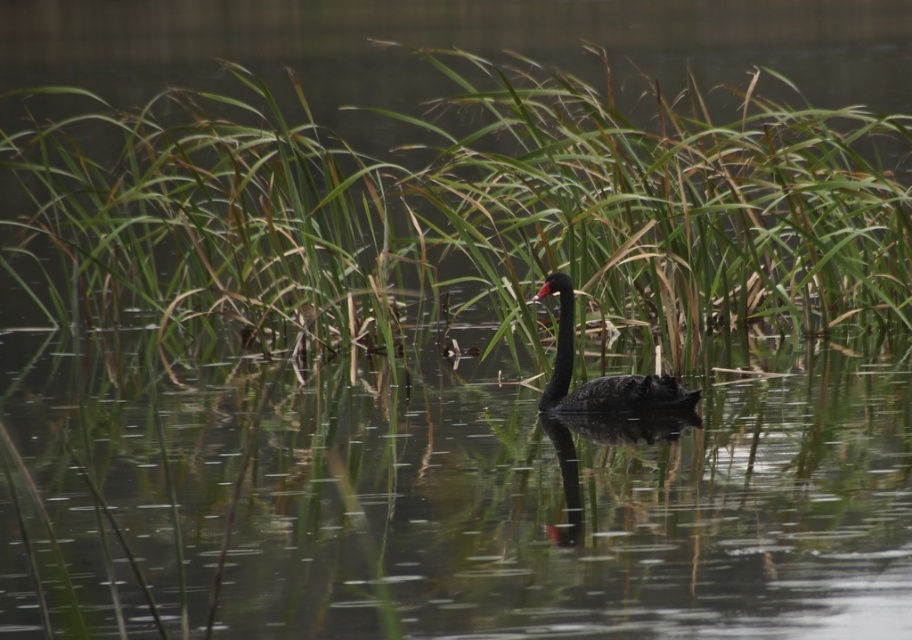
Between point (220, 346) and point (568, 408), which one is positioned in front?

Positioned in front is point (568, 408).

Which is behind, point (618, 189) or point (612, 397)?

Point (618, 189)

Between point (778, 156) and point (596, 387), which one is positioned in front?

Point (596, 387) is in front.

Locate an element on the screen. This screenshot has height=640, width=912. green grass at center is located at coordinates (461, 212).